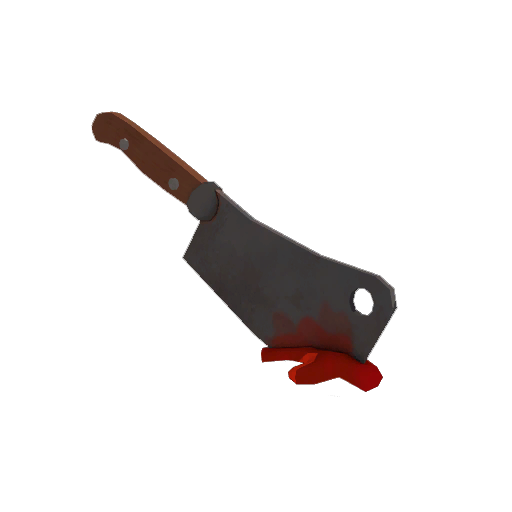
This screenshot has height=512, width=512. I want to click on brown handle, so click(x=148, y=172).